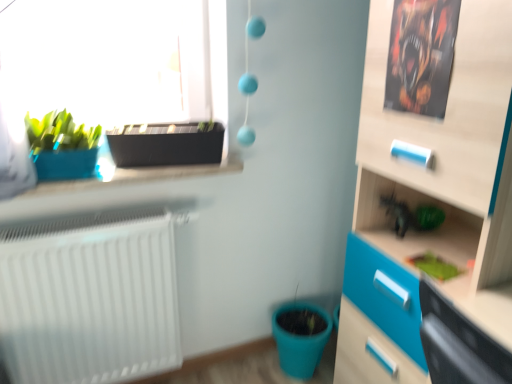
Question: Considering the relative sizes of green matte plant at lower right and black plastic flowerpot at upper left, the first flowerpot viewed from the top, in the image provided, is green matte plant at lower right taller than black plastic flowerpot at upper left, the first flowerpot viewed from the top,?

Choices:
 (A) no
 (B) yes

Answer: (A)

Question: Is green matte plant at lower right positioned with its back to black plastic flowerpot at upper left, arranged as the second flowerpot when viewed from the back?

Choices:
 (A) no
 (B) yes

Answer: (A)

Question: Is green matte plant at lower right to the right of black plastic flowerpot at upper left, the first flowerpot viewed from the top, from the viewer's perspective?

Choices:
 (A) no
 (B) yes

Answer: (B)

Question: Can you confirm if green matte plant at lower right is thinner than black plastic flowerpot at upper left, which is counted as the 1th flowerpot, starting from the front?

Choices:
 (A) yes
 (B) no

Answer: (A)

Question: Is black plastic flowerpot at upper left, arranged as the second flowerpot when viewed from the back, a part of green matte plant at lower right?

Choices:
 (A) yes
 (B) no

Answer: (B)

Question: From a real-world perspective, does green matte plant at lower right sit lower than black plastic flowerpot at upper left, the second flowerpot in the bottom-to-top sequence?

Choices:
 (A) yes
 (B) no

Answer: (A)

Question: Is green matte plant at lower right far from matte blue pot at left?

Choices:
 (A) yes
 (B) no

Answer: (A)

Question: Considering the relative sizes of green matte plant at lower right and matte blue pot at left in the image provided, is green matte plant at lower right bigger than matte blue pot at left?

Choices:
 (A) no
 (B) yes

Answer: (A)

Question: Does green matte plant at lower right come in front of matte blue pot at left?

Choices:
 (A) no
 (B) yes

Answer: (B)

Question: Are green matte plant at lower right and matte blue pot at left making contact?

Choices:
 (A) no
 (B) yes

Answer: (A)

Question: Considering the relative sizes of green matte plant at lower right and matte blue pot at left in the image provided, is green matte plant at lower right thinner than matte blue pot at left?

Choices:
 (A) yes
 (B) no

Answer: (A)

Question: Does green matte plant at lower right turn towards matte blue pot at left?

Choices:
 (A) yes
 (B) no

Answer: (B)

Question: From a real-world perspective, is black plastic flowerpot at upper left, the second flowerpot in the bottom-to-top sequence, under matte plastic flowerpot at lower center, the second flowerpot in the top-to-bottom sequence?

Choices:
 (A) no
 (B) yes

Answer: (A)